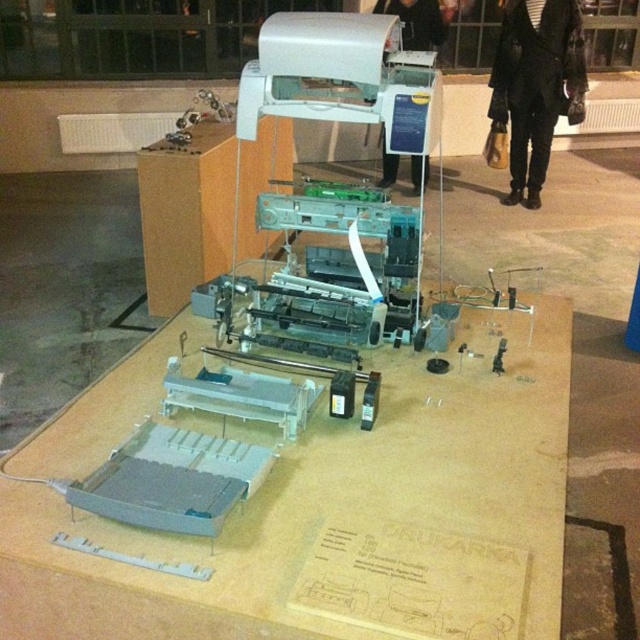
You are a technician trying to assemble a printer. You have a white plastic printer at upper center and a small signboard with text and diagrams. How far apart are these two items?

The white plastic printer at upper center and the small signboard with text and diagrams are 4.97 feet apart.

You are an engineer examining the mechanical device model on the wooden platform. You notice a specific point labeled as point [340,76]. Based on the model, where is this point located?

The point [340,76] is located on the white plastic printer at upper center.

You are setting up a display for a tech exhibition. You have a matte gray plastic table at center and a white plastic printer at upper center. Which object should you place first if you want to ensure there is enough space for both?

You should place the matte gray plastic table at center first since it is larger than the white plastic printer at upper center, ensuring there is enough space for both.